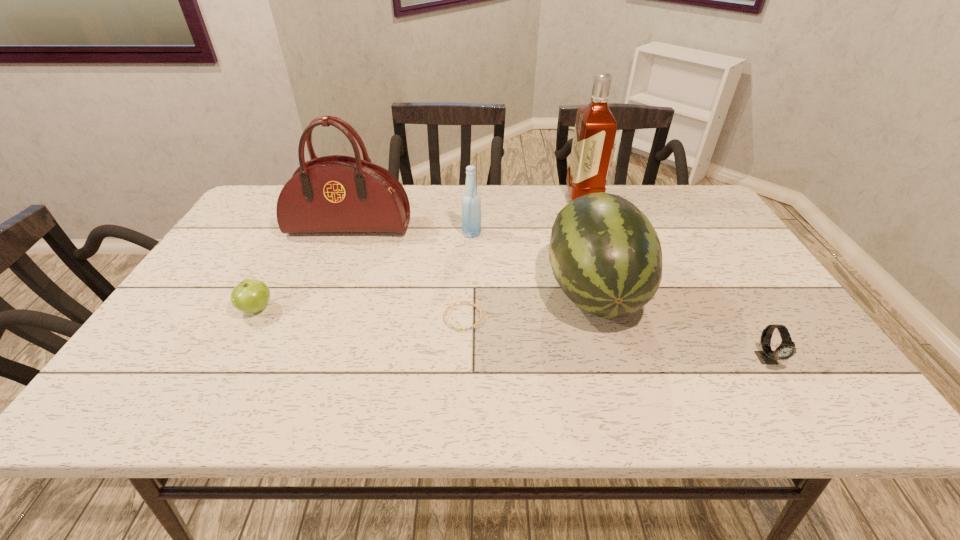
In order to click on free spot located 0.260m on the front label of the liquor in this screenshot , I will do `click(489, 199)`.

Where is `vacant space located on the front-facing side of the second tallest object`? The width and height of the screenshot is (960, 540). vacant space located on the front-facing side of the second tallest object is located at coordinates click(x=340, y=251).

The width and height of the screenshot is (960, 540). I want to click on vacant space located 0.340m on the left of the watermelon, so click(411, 291).

This screenshot has width=960, height=540. I want to click on free spot located 0.100m on the right of the bottle, so click(x=516, y=233).

Where is `vacant region located 0.330m on the back of the apple`? The height and width of the screenshot is (540, 960). vacant region located 0.330m on the back of the apple is located at coordinates (303, 222).

Locate an element on the screen. This screenshot has width=960, height=540. free location located 0.070m on the face of the watch is located at coordinates (793, 401).

What are the coordinates of `vacant area situated 0.170m on the surface of the bracelet showing star-shaped elements` in the screenshot? It's located at (460, 396).

The image size is (960, 540). Identify the location of liquor positioned at the far edge. (595, 130).

Find the location of `handbag that is at the far edge`. handbag that is at the far edge is located at coordinates 331,194.

Where is `handbag that is positioned at the left edge`? This screenshot has height=540, width=960. handbag that is positioned at the left edge is located at coordinates [331, 194].